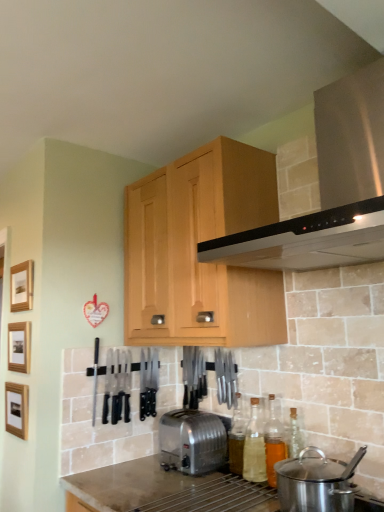
Question: Can you confirm if wooden picture frame at left, arranged as the third picture frame when viewed from the top, is thinner than wooden picture frame at left, acting as the 2th picture frame starting from the top?

Choices:
 (A) yes
 (B) no

Answer: (A)

Question: Does wooden picture frame at left, arranged as the third picture frame when viewed from the top, have a lesser height compared to wooden picture frame at left, which ranks as the second picture frame in bottom-to-top order?

Choices:
 (A) yes
 (B) no

Answer: (B)

Question: Is wooden picture frame at left, the 1th picture frame ordered from the bottom, behind wooden picture frame at left, acting as the 2th picture frame starting from the top?

Choices:
 (A) yes
 (B) no

Answer: (B)

Question: From the image's perspective, is wooden picture frame at left, arranged as the third picture frame when viewed from the top, above wooden picture frame at left, which ranks as the second picture frame in bottom-to-top order?

Choices:
 (A) no
 (B) yes

Answer: (A)

Question: Could wooden picture frame at left, acting as the 2th picture frame starting from the top, be considered to be inside wooden picture frame at left, arranged as the third picture frame when viewed from the top?

Choices:
 (A) yes
 (B) no

Answer: (B)

Question: In the image, is satin silver toaster at center positioned in front of or behind wooden picture frame at left, acting as the 2th picture frame starting from the top?

Choices:
 (A) behind
 (B) front

Answer: (B)

Question: From a real-world perspective, relative to wooden picture frame at left, which ranks as the second picture frame in bottom-to-top order, is satin silver toaster at center vertically above or below?

Choices:
 (A) below
 (B) above

Answer: (A)

Question: In terms of size, does satin silver toaster at center appear bigger or smaller than wooden picture frame at left, which ranks as the second picture frame in bottom-to-top order?

Choices:
 (A) small
 (B) big

Answer: (B)

Question: Is satin silver toaster at center wider or thinner than wooden picture frame at left, which ranks as the second picture frame in bottom-to-top order?

Choices:
 (A) thin
 (B) wide

Answer: (B)

Question: From the image's perspective, is clear glass bottle at lower right, which ranks as the second bottle in left-to-right order, located above or below wooden picture frame at left, the 1th picture frame ordered from the bottom?

Choices:
 (A) above
 (B) below

Answer: (B)

Question: From a real-world perspective, is clear glass bottle at lower right, which ranks as the second bottle in left-to-right order, above or below wooden picture frame at left, the 1th picture frame ordered from the bottom?

Choices:
 (A) below
 (B) above

Answer: (A)

Question: In terms of height, does clear glass bottle at lower right, which ranks as the second bottle in left-to-right order, look taller or shorter compared to wooden picture frame at left, the 1th picture frame ordered from the bottom?

Choices:
 (A) short
 (B) tall

Answer: (B)

Question: Would you say clear glass bottle at lower right, which ranks as the second bottle in left-to-right order, is inside or outside wooden picture frame at left, arranged as the third picture frame when viewed from the top?

Choices:
 (A) inside
 (B) outside

Answer: (B)

Question: Is wooden picture frame at left, arranged as the third picture frame when viewed from the top, in front of or behind stainless steel range hood at upper center in the image?

Choices:
 (A) front
 (B) behind

Answer: (B)

Question: Visually, is wooden picture frame at left, arranged as the third picture frame when viewed from the top, positioned to the left or to the right of stainless steel range hood at upper center?

Choices:
 (A) left
 (B) right

Answer: (A)